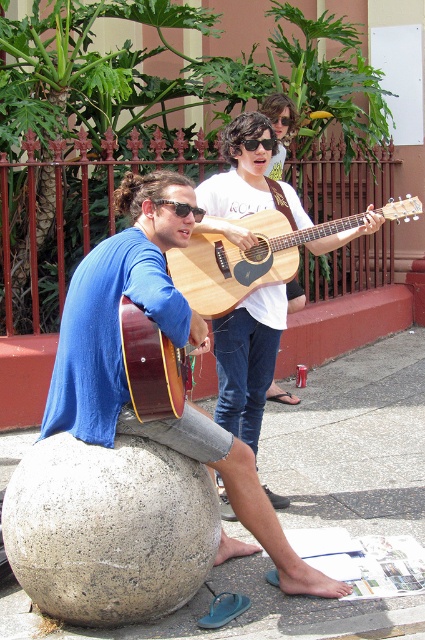
You are a photographer trying to capture a portrait of both the matte blue shirt at left and the sunglasses at center. Since you can only focus on one subject at a time, which one should you focus on to ensure the other remains in the background?

You should focus on the matte blue shirt at left because it is to the left of sunglasses at center, so when focused on the closer subject, the other will naturally be in the background.

You are a photographer trying to capture a closeup shot of the matte blue shirt at left and the sunglasses at center. Your camera can focus on objects within a 30 inch range. Can you capture both in focus without moving the camera?

The matte blue shirt at left is 31.58 inches from the sunglasses at center, which exceeds the camera focus range of 30 inches. Therefore, you cannot capture both in focus without moving the camera.